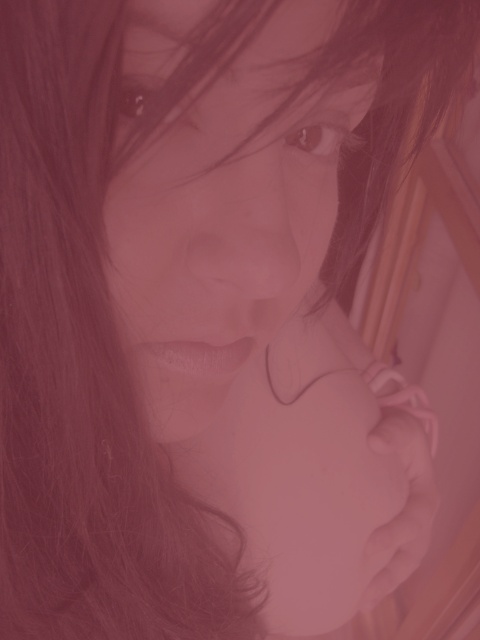
Question: Can you confirm if smooth skin nose at center is thinner than brown glossy eye at upper center?

Choices:
 (A) no
 (B) yes

Answer: (A)

Question: Which of the following is the farthest from the observer?

Choices:
 (A) matte brown eye at upper center
 (B) smooth skin nose at center
 (C) matte black eye at upper center

Answer: (B)

Question: Considering the real-world distances, which object is farthest from the pink matte hand at center?

Choices:
 (A) matte brown eye at upper center
 (B) matte black eye at upper center

Answer: (A)

Question: Which object appears farthest from the camera in this image?

Choices:
 (A) pink matte hand at center
 (B) matte brown eye at upper center
 (C) matte black eye at upper center

Answer: (A)

Question: Is smooth skin face at center thinner than pink matte hand at center?

Choices:
 (A) yes
 (B) no

Answer: (A)

Question: Is matte black eye at upper center bigger than brown glossy eye at upper center?

Choices:
 (A) yes
 (B) no

Answer: (B)